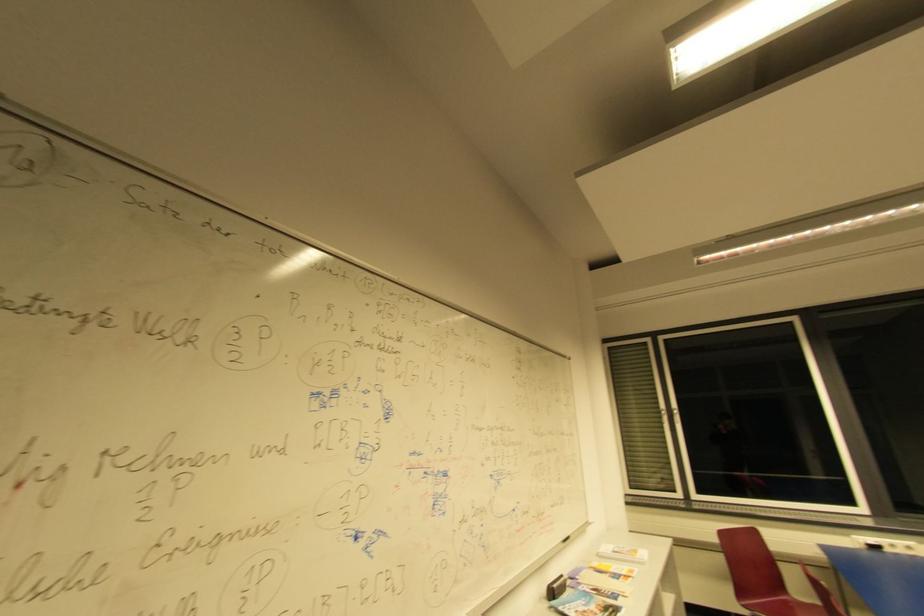
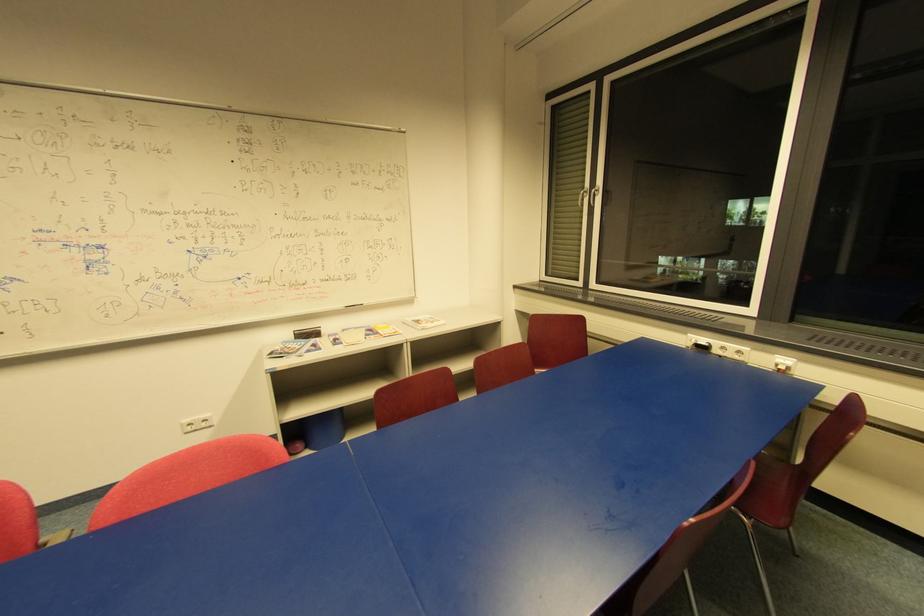
The point at (678, 413) is marked in the first image. Where is the corresponding point in the second image?

(598, 192)